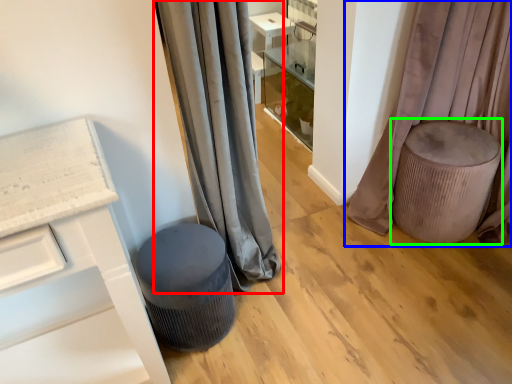
Question: Which object is the closest to the curtain (highlighted by a red box)? Choose among these: curtain (highlighted by a blue box) or swivel chair (highlighted by a green box).

Choices:
 (A) curtain
 (B) swivel chair

Answer: (B)